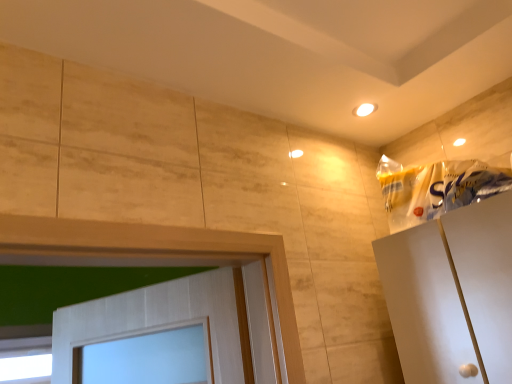
In order to face translucent plastic bag at upper right, should I rotate leftwards or rightwards?

To face it directly, rotate right by 22.967 degrees.

Where is `translucent plastic bag at upper right`? translucent plastic bag at upper right is located at coordinates (436, 188).

The width and height of the screenshot is (512, 384). What do you see at coordinates (436, 188) in the screenshot? I see `translucent plastic bag at upper right` at bounding box center [436, 188].

What is the approximate width of transparent glass window at lower left?

It is 2.56 inches.

Describe the element at coordinates (26, 360) in the screenshot. This screenshot has height=384, width=512. I see `transparent glass window at lower left` at that location.

Identify the location of transparent glass window at lower left. (26, 360).

Identify the location of translucent plastic bag at upper right. This screenshot has height=384, width=512. (436, 188).

Is transparent glass window at lower left to the left of translucent plastic bag at upper right from the viewer's perspective?

Correct, you'll find transparent glass window at lower left to the left of translucent plastic bag at upper right.

Considering the positions of objects transparent glass window at lower left and translucent plastic bag at upper right in the image provided, who is in front, transparent glass window at lower left or translucent plastic bag at upper right?

Positioned in front is translucent plastic bag at upper right.

Looking at this image, which is further, (48,376) or (400,173)?

The point (48,376) is farther.

In the scene shown: From the image's perspective, would you say transparent glass window at lower left is positioned over translucent plastic bag at upper right?

No, from the image's perspective, transparent glass window at lower left is not above translucent plastic bag at upper right.

From a real-world perspective, is transparent glass window at lower left located beneath translucent plastic bag at upper right?

Yes.

Which object is thinner, transparent glass window at lower left or translucent plastic bag at upper right?

Thinner between the two is transparent glass window at lower left.

Considering the relative sizes of transparent glass window at lower left and translucent plastic bag at upper right in the image provided, is transparent glass window at lower left shorter than translucent plastic bag at upper right?

No, transparent glass window at lower left is not shorter than translucent plastic bag at upper right.

Which of these two, transparent glass window at lower left or translucent plastic bag at upper right, is bigger?

translucent plastic bag at upper right.

Is transparent glass window at lower left inside the boundaries of translucent plastic bag at upper right, or outside?

The correct answer is: outside.

Is transparent glass window at lower left directly adjacent to translucent plastic bag at upper right?

They are not placed beside each other.

Is transparent glass window at lower left oriented towards translucent plastic bag at upper right?

Yes.

Could you measure the distance between transparent glass window at lower left and translucent plastic bag at upper right?

transparent glass window at lower left is 2.18 meters from translucent plastic bag at upper right.

Where is `window behind the translucent plastic bag at upper right`? The width and height of the screenshot is (512, 384). window behind the translucent plastic bag at upper right is located at coordinates (26, 360).

Considering the relative positions of translucent plastic bag at upper right and transparent glass window at lower left in the image provided, is translucent plastic bag at upper right to the left or to the right of transparent glass window at lower left?

translucent plastic bag at upper right is to the right of transparent glass window at lower left.

Which object is further away from the camera taking this photo, translucent plastic bag at upper right or transparent glass window at lower left?

transparent glass window at lower left is further away from the camera.

Does point (436, 188) come closer to viewer compared to point (6, 379)?

Yes, it is.

From the image's perspective, is translucent plastic bag at upper right on transparent glass window at lower left?

Yes, from the image's perspective, translucent plastic bag at upper right is on top of transparent glass window at lower left.

From a real-world perspective, which is physically below, translucent plastic bag at upper right or transparent glass window at lower left?

In real-world perspective, transparent glass window at lower left is lower.

Based on the photo, looking at their sizes, would you say translucent plastic bag at upper right is wider or thinner than transparent glass window at lower left?

translucent plastic bag at upper right is wider than transparent glass window at lower left.

Which of these two, translucent plastic bag at upper right or transparent glass window at lower left, stands taller?

With more height is transparent glass window at lower left.

Between translucent plastic bag at upper right and transparent glass window at lower left, which one has smaller size?

Smaller between the two is transparent glass window at lower left.

Choose the correct answer: Is translucent plastic bag at upper right inside transparent glass window at lower left or outside it?

translucent plastic bag at upper right is not enclosed by transparent glass window at lower left.

Is translucent plastic bag at upper right directly adjacent to transparent glass window at lower left?

translucent plastic bag at upper right and transparent glass window at lower left are clearly separated.

Does translucent plastic bag at upper right turn towards transparent glass window at lower left?

No.

How many degrees apart are the facing directions of translucent plastic bag at upper right and transparent glass window at lower left?

89.7 degrees separate the facing orientations of translucent plastic bag at upper right and transparent glass window at lower left.

Identify the location of window that appears below the translucent plastic bag at upper right (from the image's perspective). This screenshot has width=512, height=384. (26, 360).

The image size is (512, 384). Identify the location of window that is on the left side of translucent plastic bag at upper right. (26, 360).

Image resolution: width=512 pixels, height=384 pixels. I want to click on window that appears below the translucent plastic bag at upper right (from the image's perspective), so click(x=26, y=360).